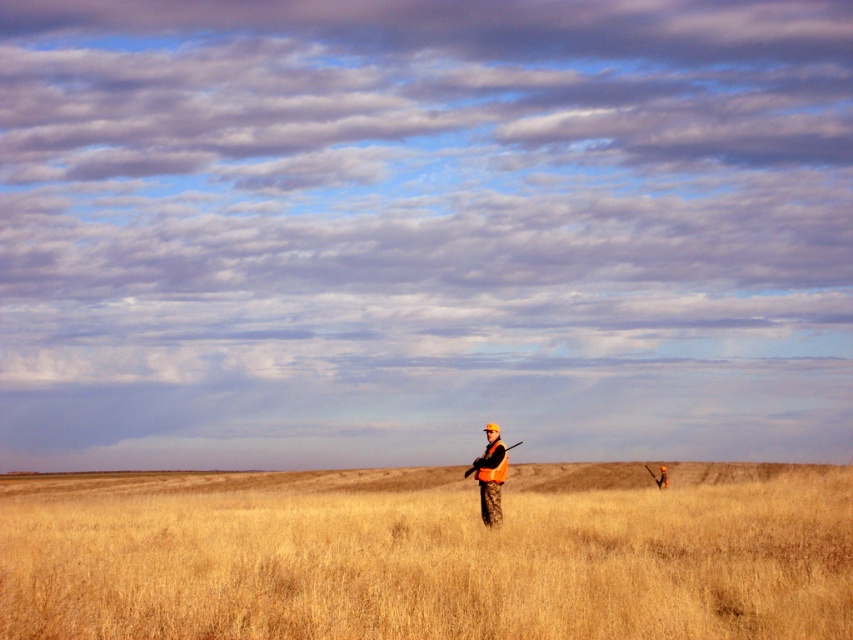
What do you see at coordinates (430, 554) in the screenshot? The height and width of the screenshot is (640, 853). I see `dry grassland at center` at bounding box center [430, 554].

Between point (445, 544) and point (659, 477), which one is positioned in front?

Point (445, 544) is in front.

Does point (811, 618) lie in front of point (659, 484)?

That is True.

Identify the location of dry grassland at center. The width and height of the screenshot is (853, 640). click(430, 554).

Which is in front, point (497, 508) or point (660, 472)?

Point (497, 508) is more forward.

Is point (485, 500) positioned in front of point (659, 484)?

Yes, point (485, 500) is closer to viewer.

Where is `camouflage jacket at center`? This screenshot has height=640, width=853. camouflage jacket at center is located at coordinates (490, 476).

Does point (596, 488) come closer to viewer compared to point (480, 518)?

That is False.

Does point (550, 538) come farther from viewer compared to point (497, 438)?

No.

I want to click on dry grassland at center, so click(x=430, y=554).

You are a GUI agent. You are given a task and a screenshot of the screen. Output one action in this format:
    pyautogui.click(x=<x>, y=<y>)
    Task: Click on the dry grassland at center
    
    Given the screenshot: What is the action you would take?
    pyautogui.click(x=430, y=554)